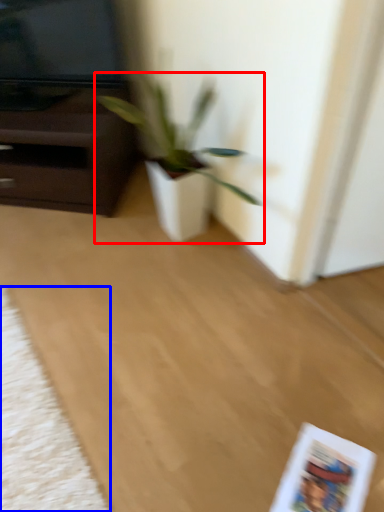
Question: Which object is further to the camera taking this photo, houseplant (highlighted by a red box) or mat (highlighted by a blue box)?

Choices:
 (A) houseplant
 (B) mat

Answer: (A)